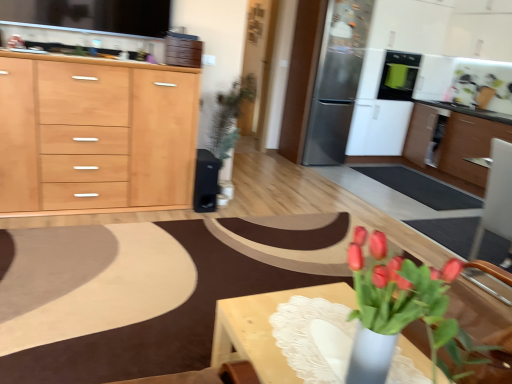
The image size is (512, 384). I want to click on free space above wooden table at lower right (from a real-world perspective), so click(x=306, y=326).